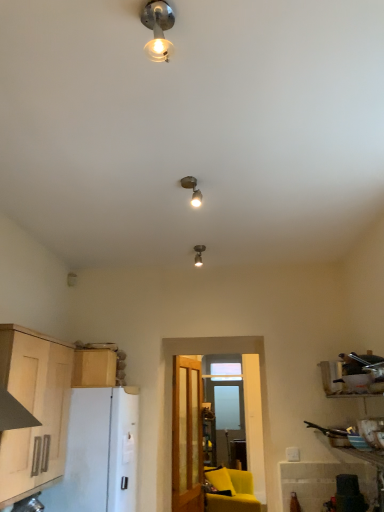
Question: Is the depth of clear glass door at center greater than that of matte yellow armchair at lower center?

Choices:
 (A) yes
 (B) no

Answer: (B)

Question: Is clear glass door at center turned away from matte yellow armchair at lower center?

Choices:
 (A) no
 (B) yes

Answer: (B)

Question: From a real-world perspective, is clear glass door at center physically above matte yellow armchair at lower center?

Choices:
 (A) yes
 (B) no

Answer: (A)

Question: From a real-world perspective, is clear glass door at center located beneath matte yellow armchair at lower center?

Choices:
 (A) no
 (B) yes

Answer: (A)

Question: From the image's perspective, is clear glass door at center below matte yellow armchair at lower center?

Choices:
 (A) no
 (B) yes

Answer: (A)

Question: Is transparent glass window at center inside or outside of metallic bulb at upper center, positioned as the 3th lamp in back-to-front order?

Choices:
 (A) outside
 (B) inside

Answer: (A)

Question: Considering the positions of point (240, 433) and point (160, 53), is point (240, 433) closer or farther from the camera than point (160, 53)?

Choices:
 (A) closer
 (B) farther

Answer: (B)

Question: Is transparent glass window at center taller or shorter than metallic bulb at upper center, the 3th lamp positioned from the bottom?

Choices:
 (A) tall
 (B) short

Answer: (A)

Question: Considering the relative positions of transparent glass window at center and metallic bulb at upper center, positioned as the 1th lamp in front-to-back order, in the image provided, is transparent glass window at center to the left or to the right of metallic bulb at upper center, positioned as the 1th lamp in front-to-back order,?

Choices:
 (A) left
 (B) right

Answer: (B)

Question: From their relative heights in the image, would you say matte yellow armchair at lower center is taller or shorter than matte silver spotlight at center, the 3th lamp when ordered from front to back?

Choices:
 (A) tall
 (B) short

Answer: (A)

Question: Looking at their shapes, would you say matte yellow armchair at lower center is wider or thinner than matte silver spotlight at center, the 3th lamp when ordered from front to back?

Choices:
 (A) thin
 (B) wide

Answer: (B)

Question: From the image's perspective, is matte yellow armchair at lower center located above or below matte silver spotlight at center, placed as the 3th lamp when sorted from top to bottom?

Choices:
 (A) above
 (B) below

Answer: (B)

Question: From a real-world perspective, is matte yellow armchair at lower center positioned above or below matte silver spotlight at center, placed as the 3th lamp when sorted from top to bottom?

Choices:
 (A) below
 (B) above

Answer: (A)

Question: Is matte silver spotlight at center, which ranks as the 1th lamp in bottom-to-top order, spatially inside light wood cabinet at left, arranged as the 2th cabinetry when viewed from the back, or outside of it?

Choices:
 (A) inside
 (B) outside

Answer: (B)

Question: From a real-world perspective, relative to light wood cabinet at left, arranged as the 2th cabinetry when viewed from the back, is matte silver spotlight at center, the 3th lamp when ordered from front to back, vertically above or below?

Choices:
 (A) below
 (B) above

Answer: (B)